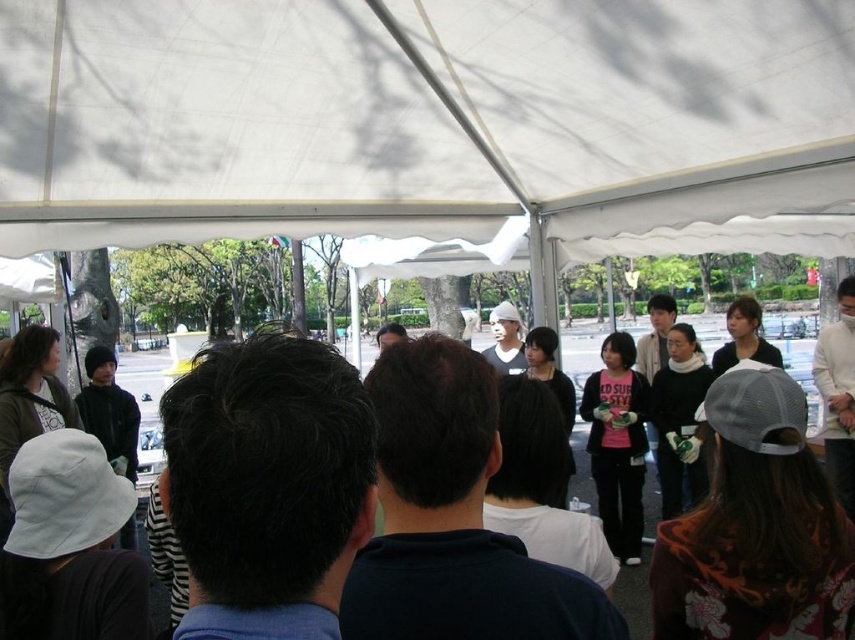
Does point (222, 184) come closer to viewer compared to point (812, 417)?

Yes, point (222, 184) is closer to viewer.

Can you confirm if white fabric canopy at upper center is shorter than matte black jacket at center?

Yes, white fabric canopy at upper center is shorter than matte black jacket at center.

Does point (160, 109) lie behind point (572, 445)?

No, it is not.

Identify the location of white fabric canopy at upper center. Image resolution: width=855 pixels, height=640 pixels. (422, 118).